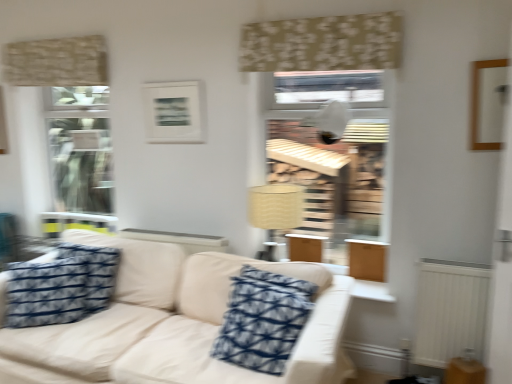
The width and height of the screenshot is (512, 384). In order to click on blank space above beige textured curtain at upper left, positioned as the 2th curtain in front-to-back order (from a real-world perspective) in this screenshot , I will do `click(49, 38)`.